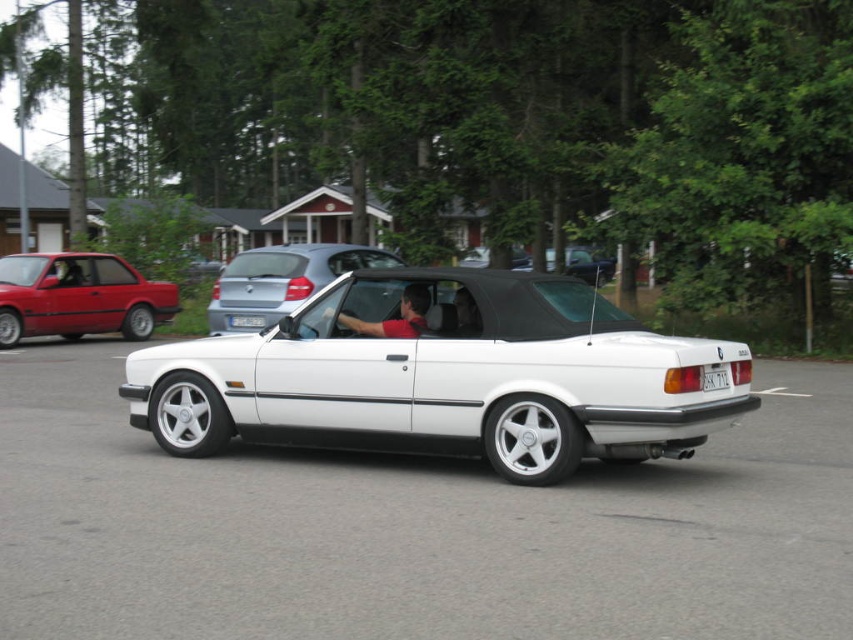
Who is taller, white matte convertible at center or matte black convertible at center?

white matte convertible at center

Between white matte convertible at center and matte black convertible at center, which one is positioned higher?

Positioned higher is matte black convertible at center.

The image size is (853, 640). Identify the location of white matte convertible at center. (445, 378).

At what (x,y) coordinates should I click in order to perform the action: click on white matte convertible at center. Please return your answer as a coordinate pair (x, y). The image size is (853, 640). Looking at the image, I should click on (445, 378).

Is white metallic car at center smaller than matte black convertible at center?

Incorrect, white metallic car at center is not smaller in size than matte black convertible at center.

Does point (744, 468) come farther from viewer compared to point (564, 266)?

No, it is in front of (564, 266).

Find the location of a particular element. The height and width of the screenshot is (640, 853). white metallic car at center is located at coordinates (413, 529).

In the scene shown: Can you confirm if white matte convertible at center is wider than red plastic license plate at center?

Yes, white matte convertible at center is wider than red plastic license plate at center.

Who is more forward, (x=547, y=378) or (x=704, y=378)?

Point (x=547, y=378) is more forward.

The height and width of the screenshot is (640, 853). What are the coordinates of `white matte convertible at center` in the screenshot? It's located at (445, 378).